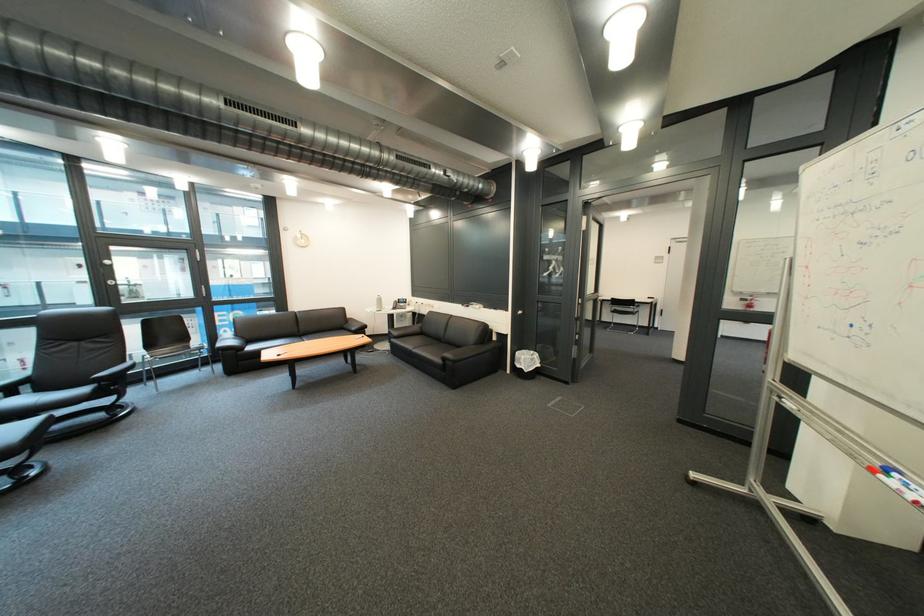
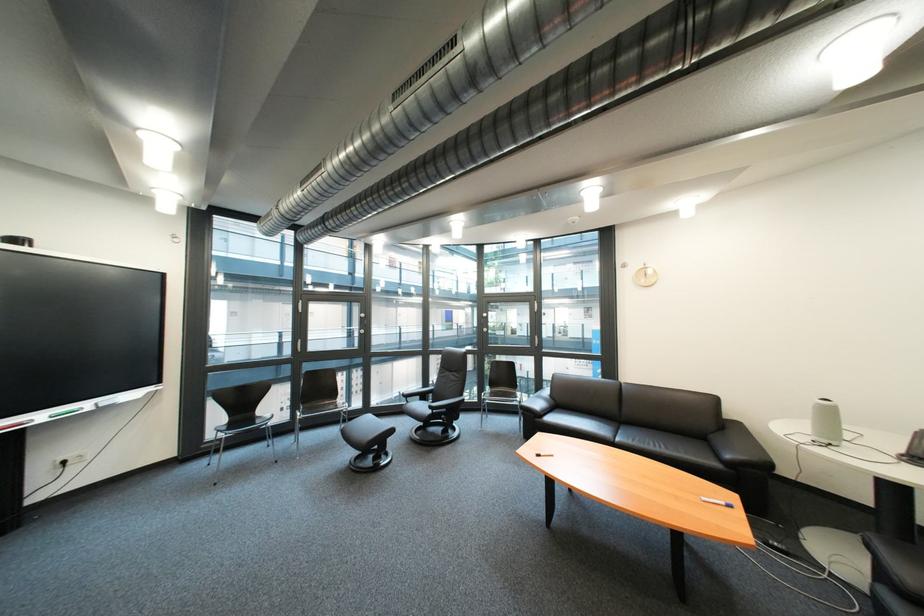
Find the pixel in the second image that matches point 368,331 in the first image.

(742, 458)